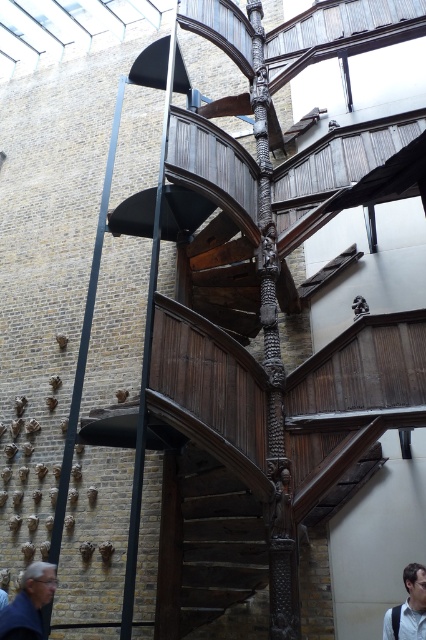
Question: Which is nearer to the gray hair at lower left?

Choices:
 (A) black metal pole at left
 (B) black metal pole at center

Answer: (A)

Question: Can you confirm if black metal pole at center is positioned to the left of gray hair at lower left?

Choices:
 (A) yes
 (B) no

Answer: (B)

Question: Among these points, which one is farthest from the camera?

Choices:
 (A) (115, 122)
 (B) (184, 512)
 (C) (42, 636)
 (D) (137, 548)

Answer: (A)

Question: Observing the image, what is the correct spatial positioning of black metal pole at left in reference to gray hair at lower left?

Choices:
 (A) left
 (B) right

Answer: (A)

Question: Is black metal pole at left wider than light blue shirt at lower right?

Choices:
 (A) no
 (B) yes

Answer: (A)

Question: Which point is closer to the camera?

Choices:
 (A) (97, 225)
 (B) (218, 490)
 (C) (29, 577)

Answer: (C)